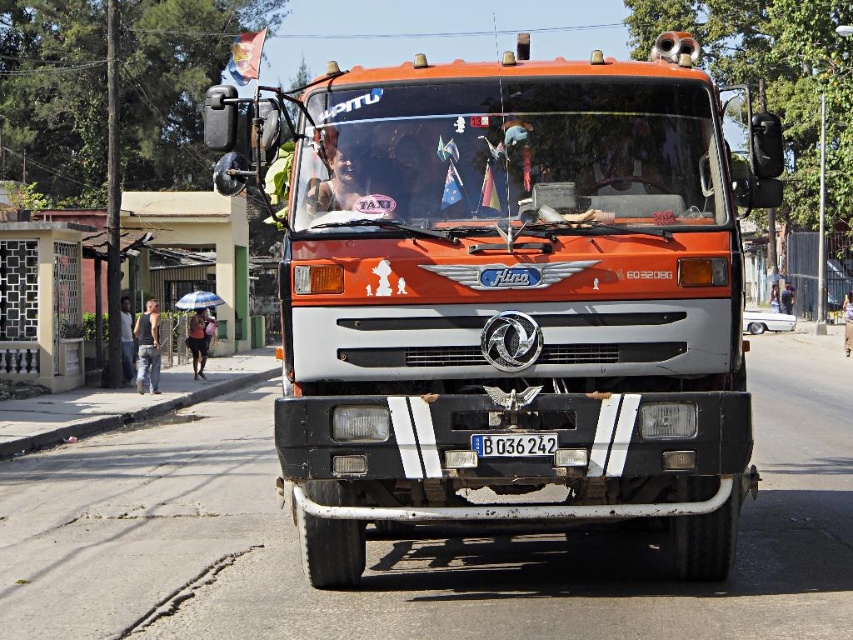
Question: Can you confirm if blue plastic license plate at center is wider than dark blue fabric umbrella at lower left?

Choices:
 (A) no
 (B) yes

Answer: (A)

Question: Can you confirm if blue plastic license plate at center is positioned to the right of denim jeans at left?

Choices:
 (A) no
 (B) yes

Answer: (B)

Question: Which object appears closest to the camera in this image?

Choices:
 (A) blue plastic license plate at center
 (B) blue fabric umbrella at center
 (C) denim pants at left
 (D) matte plastic face at center

Answer: (A)

Question: Which object is closer to the camera taking this photo?

Choices:
 (A) blue fabric umbrella at center
 (B) matte plastic face at center
 (C) dark blue jeans at center
 (D) denim pants at left

Answer: (B)

Question: Estimate the real-world distances between objects in this image. Which object is farther from the denim jeans at left?

Choices:
 (A) dark blue jeans at center
 (B) matte black face at center
 (C) blue plastic license plate at center

Answer: (A)

Question: Is matte black face at center further to camera compared to denim jeans at left?

Choices:
 (A) yes
 (B) no

Answer: (B)